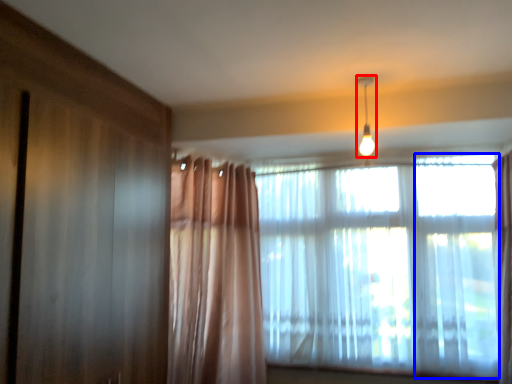
Question: Which point is closer to the camera, light fixture (highlighted by a red box) or window (highlighted by a blue box)?

Choices:
 (A) light fixture
 (B) window

Answer: (B)